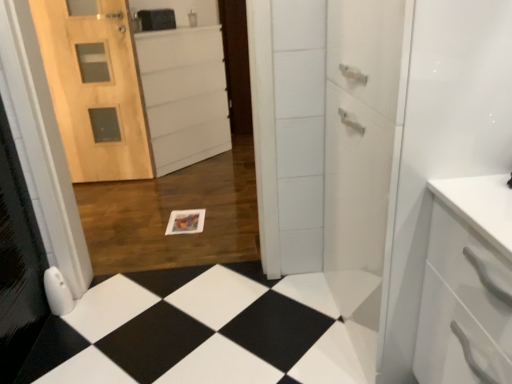
The width and height of the screenshot is (512, 384). Identify the location of free area below natural wood door at left (from a real-world perspective). (105, 181).